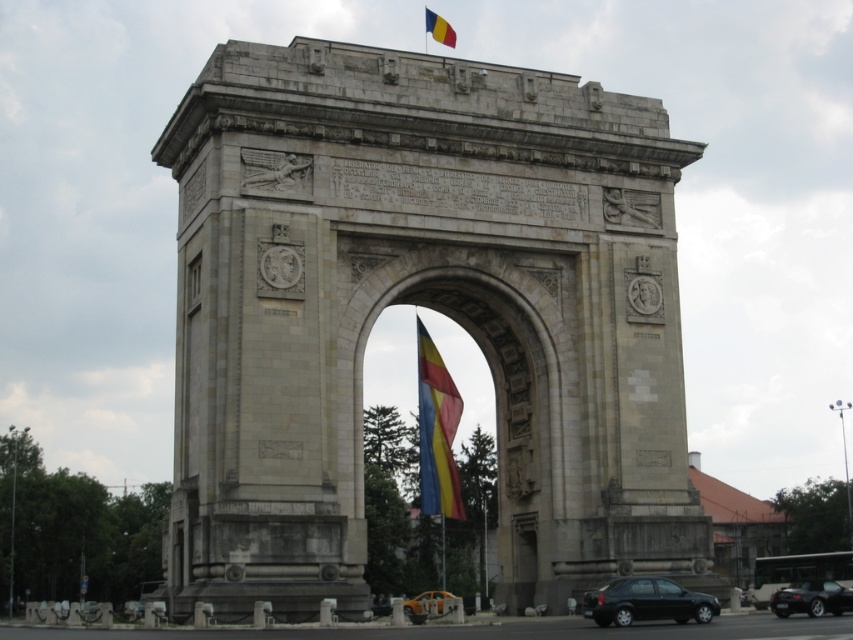
Does polyester flag at center have a greater width compared to black matte car at lower right?

Indeed, polyester flag at center has a greater width compared to black matte car at lower right.

Is point (440, 468) positioned after point (605, 612)?

Yes, point (440, 468) is farther from viewer.

In order to click on polyester flag at center in this screenshot , I will do `click(436, 432)`.

Measure the distance between shiny black car at lower right and camera.

shiny black car at lower right and camera are 60.50 meters apart from each other.

Is point (815, 588) positioned behind point (432, 593)?

No, (815, 588) is closer to viewer.

Is point (834, 580) more distant than point (431, 593)?

No, it is in front of (431, 593).

This screenshot has height=640, width=853. I want to click on shiny black car at lower right, so click(811, 598).

Between polyester flag at center and shiny black car at lower right, which one is positioned higher?

Positioned higher is polyester flag at center.

Identify the location of polyester flag at center. (436, 432).